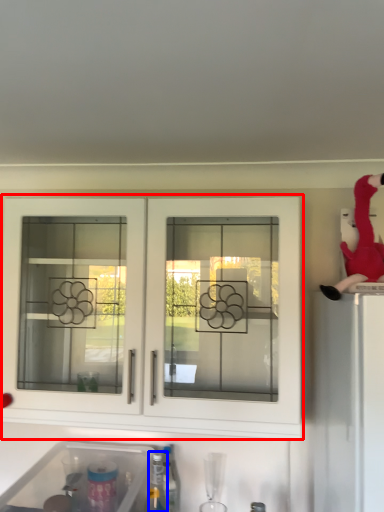
Question: Which point is further to the camera, cabinetry (highlighted by a red box) or bottle (highlighted by a blue box)?

Choices:
 (A) cabinetry
 (B) bottle

Answer: (B)